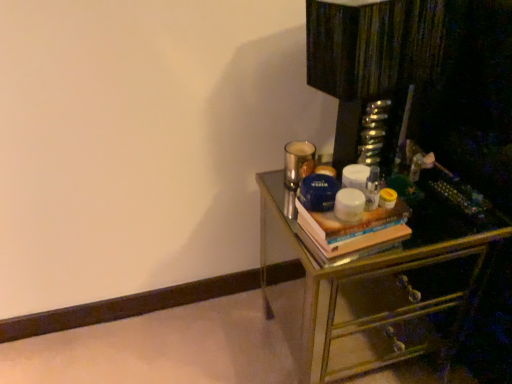
Question: Is hardcover book at right bigger or smaller than metallic mirrored chest of drawers at right?

Choices:
 (A) big
 (B) small

Answer: (B)

Question: From the image's perspective, is hardcover book at right positioned above or below metallic mirrored chest of drawers at right?

Choices:
 (A) above
 (B) below

Answer: (A)

Question: Is hardcover book at right wider or thinner than metallic mirrored chest of drawers at right?

Choices:
 (A) thin
 (B) wide

Answer: (A)

Question: Does point (462, 334) appear closer or farther from the camera than point (368, 241)?

Choices:
 (A) closer
 (B) farther

Answer: (B)

Question: From the image's perspective, is metallic mirrored chest of drawers at right located above or below hardcover book at right?

Choices:
 (A) above
 (B) below

Answer: (B)

Question: Considering the relative positions of metallic mirrored chest of drawers at right and hardcover book at right in the image provided, is metallic mirrored chest of drawers at right to the left or to the right of hardcover book at right?

Choices:
 (A) right
 (B) left

Answer: (A)

Question: Looking at the image, does metallic mirrored chest of drawers at right seem bigger or smaller compared to hardcover book at right?

Choices:
 (A) small
 (B) big

Answer: (B)